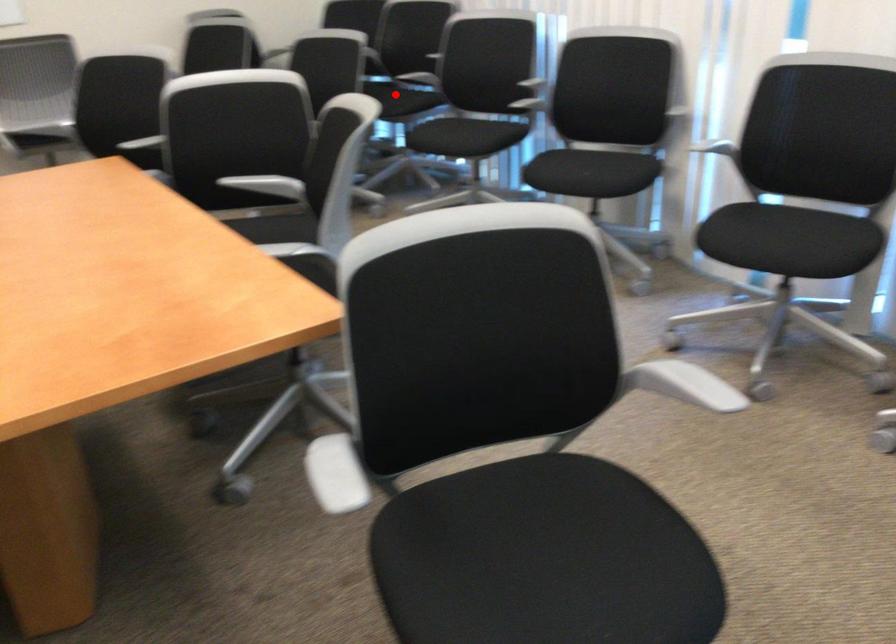
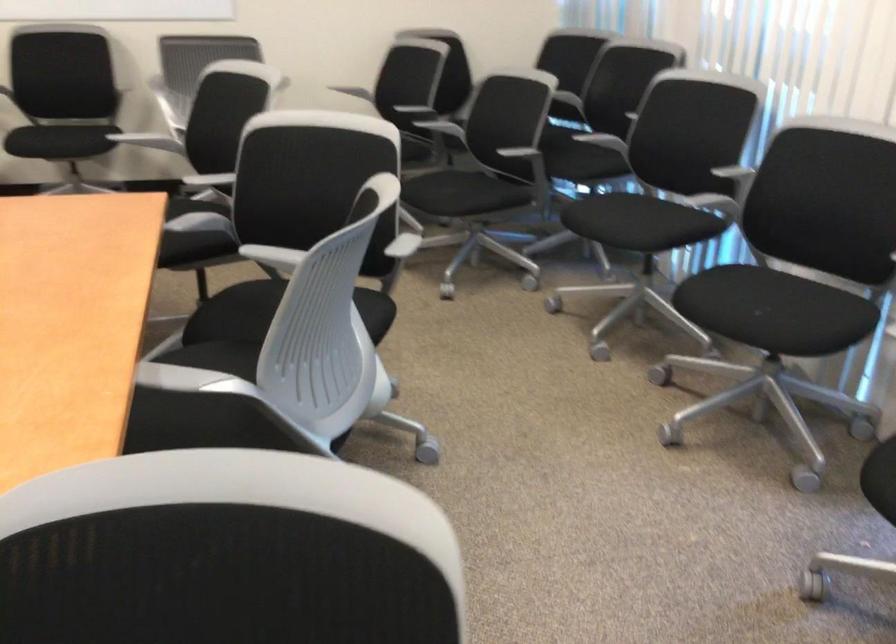
Question: A red point is marked in image1. In image2, is the corresponding 3D point closer to the camera or farther? Reply with the corresponding letter.

Choices:
 (A) The corresponding 3D point is closer.
 (B) The corresponding 3D point is farther.

Answer: (A)